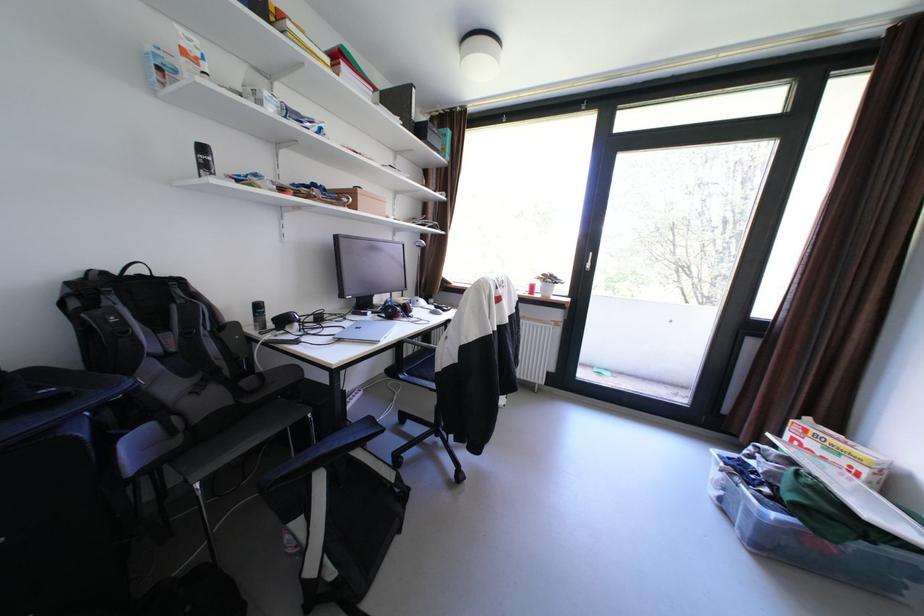
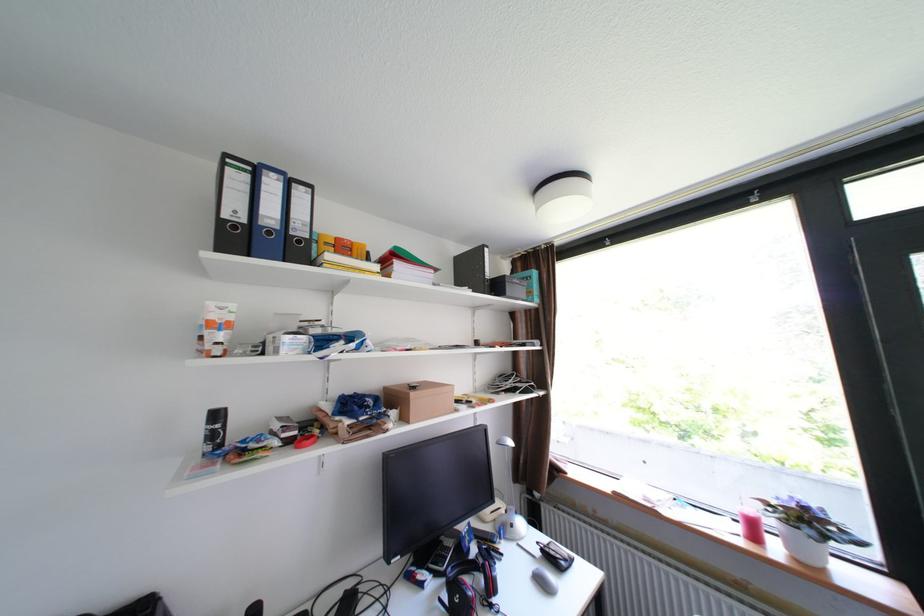
Based on the continuous images, in which direction is the camera rotating?

The camera rotated toward left-up.